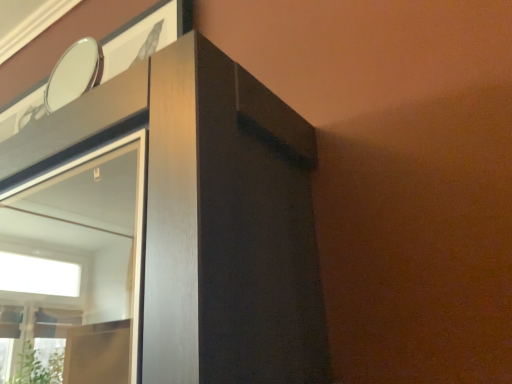
Question: From the image's perspective, is metallic silver mirror at upper left located beneath matte wood dresser at upper left?

Choices:
 (A) yes
 (B) no

Answer: (B)

Question: Does metallic silver mirror at upper left have a greater height compared to matte wood dresser at upper left?

Choices:
 (A) yes
 (B) no

Answer: (B)

Question: Can you confirm if metallic silver mirror at upper left is thinner than matte wood dresser at upper left?

Choices:
 (A) yes
 (B) no

Answer: (A)

Question: Is metallic silver mirror at upper left turned away from matte wood dresser at upper left?

Choices:
 (A) yes
 (B) no

Answer: (B)

Question: Is metallic silver mirror at upper left shorter than matte wood dresser at upper left?

Choices:
 (A) no
 (B) yes

Answer: (B)

Question: Does metallic silver mirror at upper left appear on the right side of matte wood dresser at upper left?

Choices:
 (A) no
 (B) yes

Answer: (B)

Question: Can you confirm if matte wood dresser at upper left is wider than metallic silver mirror at upper left?

Choices:
 (A) yes
 (B) no

Answer: (A)

Question: Is metallic silver mirror at upper left at the back of matte wood dresser at upper left?

Choices:
 (A) yes
 (B) no

Answer: (B)

Question: Can you confirm if matte wood dresser at upper left is smaller than metallic silver mirror at upper left?

Choices:
 (A) yes
 (B) no

Answer: (B)

Question: Can we say matte wood dresser at upper left lies outside metallic silver mirror at upper left?

Choices:
 (A) yes
 (B) no

Answer: (A)

Question: Is matte wood dresser at upper left positioned behind metallic silver mirror at upper left?

Choices:
 (A) yes
 (B) no

Answer: (B)

Question: Considering the relative sizes of matte wood dresser at upper left and metallic silver mirror at upper left in the image provided, is matte wood dresser at upper left thinner than metallic silver mirror at upper left?

Choices:
 (A) no
 (B) yes

Answer: (A)

Question: In the image, is matte wood dresser at upper left positioned in front of or behind metallic silver mirror at upper left?

Choices:
 (A) behind
 (B) front

Answer: (B)